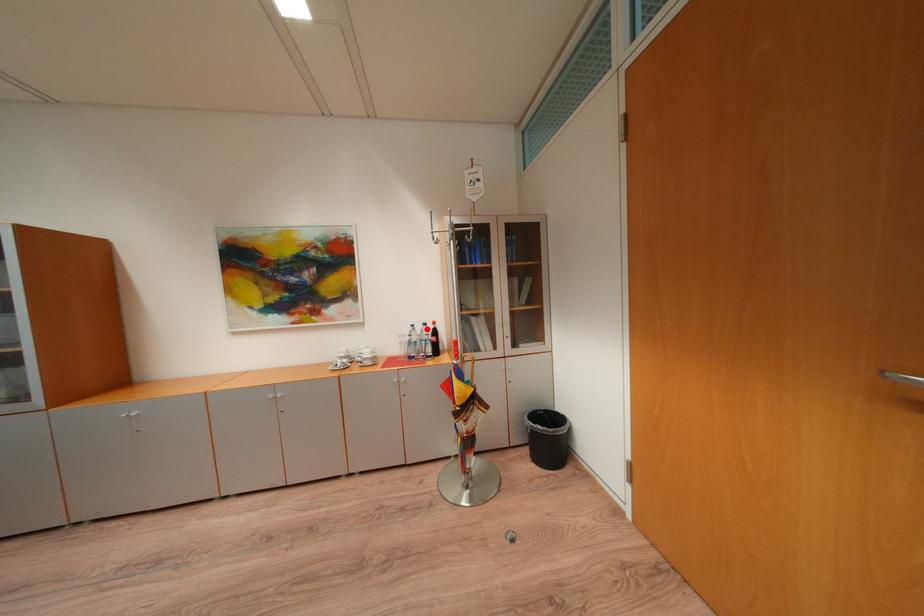
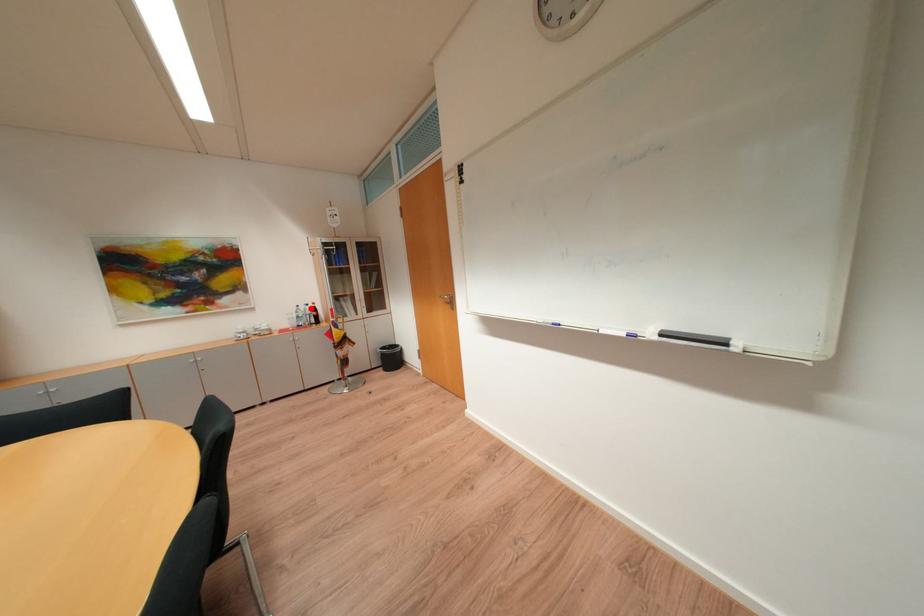
I am providing you with two images of the same scene from different viewpoints. A red point is marked on the first image and another point is marked on the second image. Is the red point in image1 aligned with the point shown in image2?

Yes